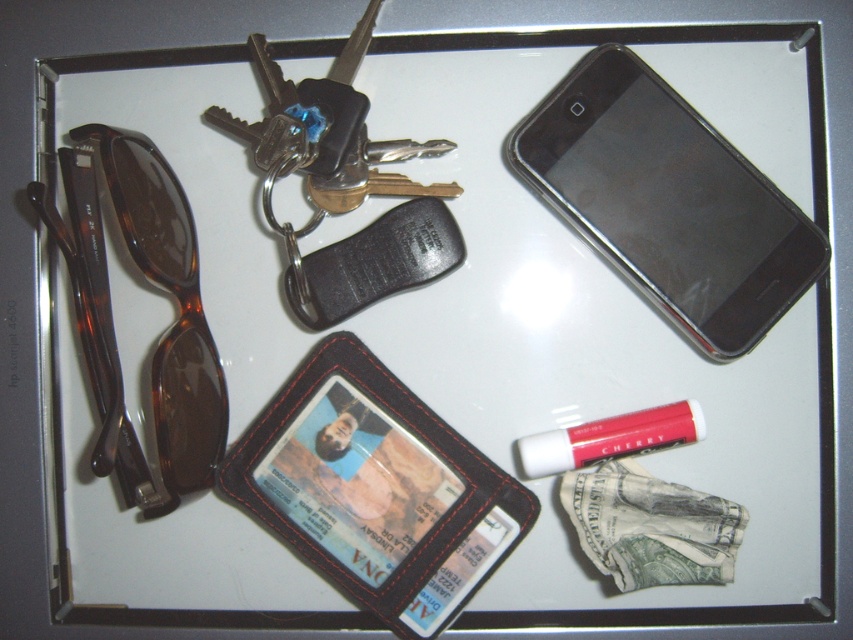
You are organizing items on a table and need to place a new item between the tortoiseshell plastic goggles at left and the matte cherry lipstick at lower right. If the new item requires 10 inches of space, will there be enough room?

The distance between the tortoiseshell plastic goggles at left and matte cherry lipstick at lower right is 17.80 inches. Since the new item needs 10 inches, there is sufficient space to place it between them.

You are organizing items on a table and need to place the black plastic smartphone at upper right and the tortoiseshell plastic goggles at left. According to the image, which item is positioned higher on the table?

The black plastic smartphone at upper right is positioned higher on the table than the tortoiseshell plastic goggles at left.

You are organizing a drawer and need to stack the tortoiseshell plastic goggles at left and the matte cherry lipstick at lower right vertically. Which item should go on the bottom to ensure stability?

The tortoiseshell plastic goggles at left should go on the bottom because they have a greater height than the matte cherry lipstick at lower right, providing a stable base.